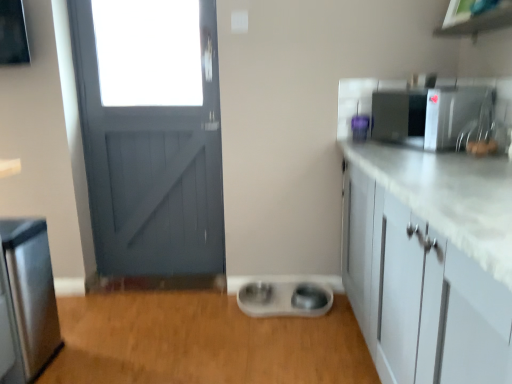
You are a GUI agent. You are given a task and a screenshot of the screen. Output one action in this format:
    pyautogui.click(x=<x>, y=<y>)
    Task: Click on the vacant space to the right of stainless steel refrigerator at left, which is counted as the first appliance, starting from the left
    The image size is (512, 384).
    Given the screenshot: What is the action you would take?
    pyautogui.click(x=83, y=356)